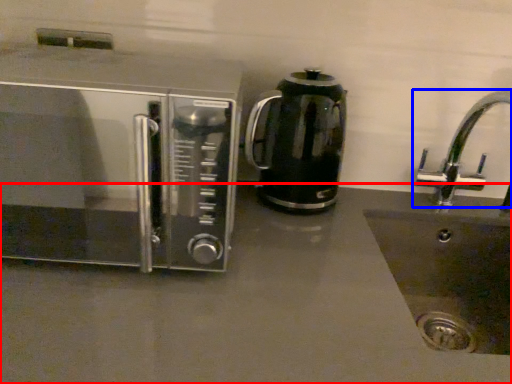
Question: Which object is closer to the camera taking this photo, counter top (highlighted by a red box) or tap (highlighted by a blue box)?

Choices:
 (A) counter top
 (B) tap

Answer: (A)